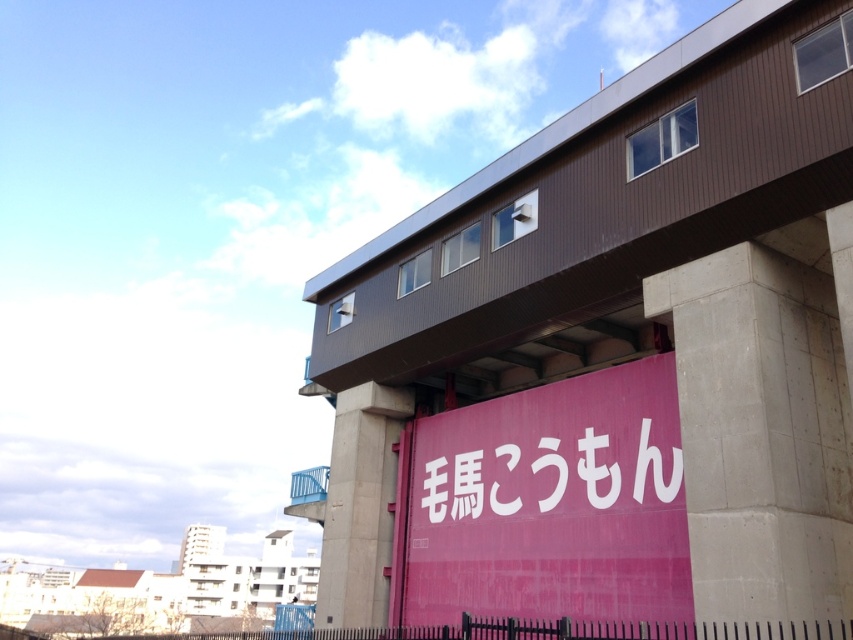
You are a delivery person trying to navigate through the area. You see the brown wood overpass at upper center and the white matte sign at center. Which object is larger in size?

The brown wood overpass at upper center is bigger than the white matte sign at center, so the brown wood overpass at upper center is larger in size.

You are standing at the entrance of the structure and want to reach the brown wood overpass at upper center. According to the coordinates provided, what are the exact coordinates you need to move towards?

The exact coordinates to move towards are point (601, 202).

You are standing in front of the building and want to reach the point at coordinates point (514,150). The fence is 10 meters away from you. Can you safely walk to that point without crossing the fence?

The point (514,150) is 13.30 meters away from the viewer. Since the fence is only 10 meters away, the point is beyond the fence. Therefore, you cannot safely walk to that point without crossing the fence.